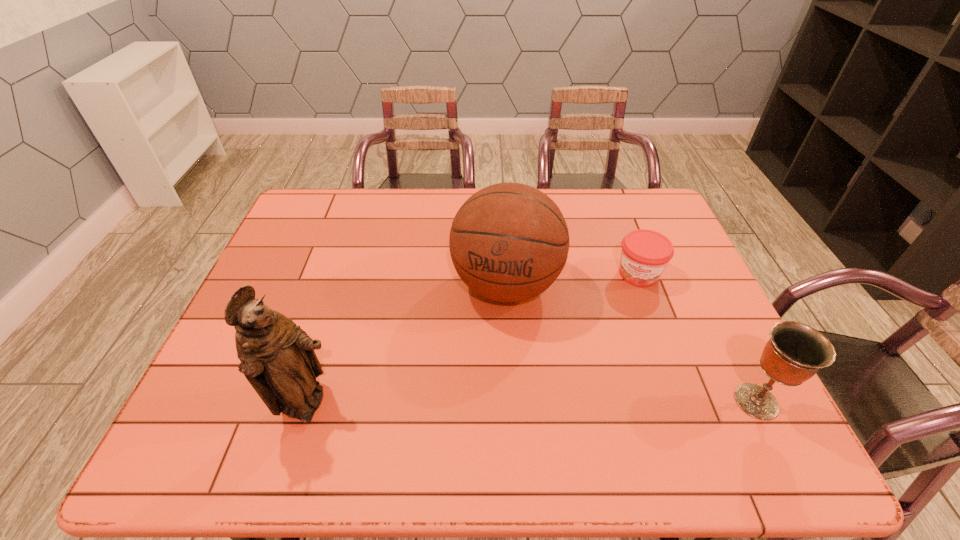
This screenshot has width=960, height=540. What are the coordinates of `vacant spot on the desktop that is between the figurine and the rightmost object and is positioned on the label side of the third object from left to right` in the screenshot? It's located at (600, 403).

Image resolution: width=960 pixels, height=540 pixels. In order to click on vacant space on the desktop that is between the leftmost object and the rightmost object and is positioned on the side with brand label of the basketball in this screenshot , I will do `click(477, 404)`.